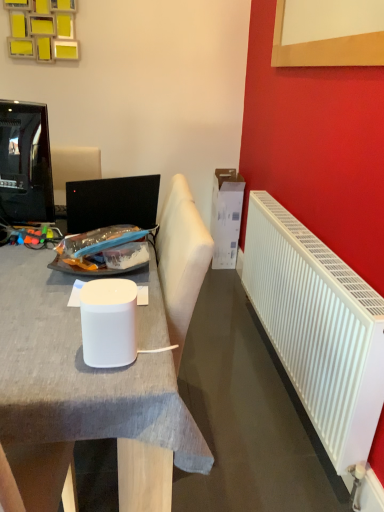
At what (x,y) coordinates should I click in order to perform the action: click on free spot behind white glossy paper cup at center. Please return your answer as a coordinate pair (x, y). Image resolution: width=384 pixels, height=512 pixels. Looking at the image, I should click on (130, 314).